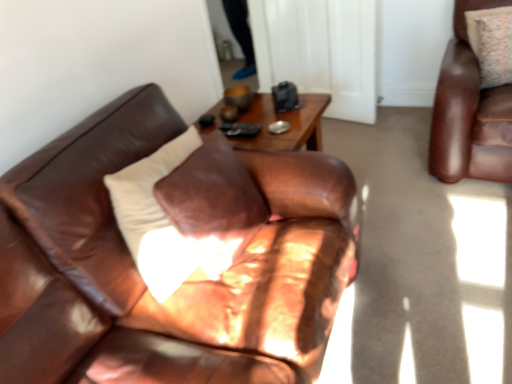
The width and height of the screenshot is (512, 384). Describe the element at coordinates (186, 282) in the screenshot. I see `matte brown leather couch at center` at that location.

Image resolution: width=512 pixels, height=384 pixels. I want to click on transparent glass door at upper center, so point(319,51).

Image resolution: width=512 pixels, height=384 pixels. Describe the element at coordinates (478, 24) in the screenshot. I see `patterned fabric pillow at upper right` at that location.

Where is `matte brown leather couch at center`? This screenshot has width=512, height=384. matte brown leather couch at center is located at coordinates (186, 282).

Does transparent glass door at upper center turn towards matte brown leather couch at center?

No.

Does transparent glass door at upper center have a larger size compared to matte brown leather couch at center?

Incorrect, transparent glass door at upper center is not larger than matte brown leather couch at center.

In the image, is transparent glass door at upper center on the left side or the right side of matte brown leather couch at center?

transparent glass door at upper center is to the left of matte brown leather couch at center.

From the image's perspective, is transparent glass door at upper center located beneath matte brown leather couch at center?

No.

Which of these two, patterned fabric pillow at upper right or transparent glass door at upper center, is smaller?

patterned fabric pillow at upper right is smaller.

Can you tell me how much patterned fabric pillow at upper right and transparent glass door at upper center differ in facing direction?

23.5 degrees separate the facing orientations of patterned fabric pillow at upper right and transparent glass door at upper center.

How distant is patterned fabric pillow at upper right from transparent glass door at upper center?

patterned fabric pillow at upper right and transparent glass door at upper center are 35.30 inches apart from each other.

From the image's perspective, is patterned fabric pillow at upper right above or below transparent glass door at upper center?

Based on their image positions, patterned fabric pillow at upper right is located beneath transparent glass door at upper center.

Does matte brown leather couch at center appear on the left side of transparent glass door at upper center?

In fact, matte brown leather couch at center is to the right of transparent glass door at upper center.

Could you tell me if matte brown leather couch at center is turned towards transparent glass door at upper center?

No.

Find the location of a particular element. studio couch that is in front of the transparent glass door at upper center is located at coordinates [x=186, y=282].

Is transparent glass door at upper center outside of patterned fabric pillow at upper right?

Yes, transparent glass door at upper center is outside of patterned fabric pillow at upper right.

Is the position of transparent glass door at upper center more distant than that of patterned fabric pillow at upper right?

That is True.

Can you confirm if transparent glass door at upper center is thinner than patterned fabric pillow at upper right?

Yes.

Would you say transparent glass door at upper center is a long distance from patterned fabric pillow at upper right?

No, transparent glass door at upper center is not far from patterned fabric pillow at upper right.

How much distance is there between matte brown leather couch at center and patterned fabric pillow at upper right?

They are 1.85 meters apart.

Considering the positions of objects matte brown leather couch at center and patterned fabric pillow at upper right in the image provided, who is more to the left, matte brown leather couch at center or patterned fabric pillow at upper right?

Positioned to the left is matte brown leather couch at center.

Identify the location of pillow above the matte brown leather couch at center (from a real-world perspective). The height and width of the screenshot is (384, 512). (478, 24).

Would you say matte brown leather couch at center is a long distance from patterned fabric pillow at upper right?

matte brown leather couch at center is far away from patterned fabric pillow at upper right.

From a real-world perspective, is patterned fabric pillow at upper right positioned under matte brown leather couch at center based on gravity?

Actually, patterned fabric pillow at upper right is physically above matte brown leather couch at center in the real world.

Is patterned fabric pillow at upper right spatially inside matte brown leather couch at center, or outside of it?

patterned fabric pillow at upper right is not inside matte brown leather couch at center, it's outside.

Considering the relative sizes of patterned fabric pillow at upper right and matte brown leather couch at center in the image provided, is patterned fabric pillow at upper right wider than matte brown leather couch at center?

Incorrect, the width of patterned fabric pillow at upper right does not surpass that of matte brown leather couch at center.

Is patterned fabric pillow at upper right positioned with its back to matte brown leather couch at center?

No, patterned fabric pillow at upper right is not facing away from matte brown leather couch at center.

The image size is (512, 384). What are the coordinates of `studio couch that appears in front of the transparent glass door at upper center` in the screenshot? It's located at (186, 282).

Locate an element on the screen. This screenshot has height=384, width=512. pillow on the right of transparent glass door at upper center is located at coordinates (478, 24).

From the image, which object appears to be nearer to patterned fabric pillow at upper right, matte brown leather couch at center or transparent glass door at upper center?

Among the two, transparent glass door at upper center is located nearer to patterned fabric pillow at upper right.

Which object lies further to the anchor point transparent glass door at upper center, patterned fabric pillow at upper right or matte brown leather couch at center?

Among the two, matte brown leather couch at center is located further to transparent glass door at upper center.

Looking at the image, which one is located closer to transparent glass door at upper center, matte brown leather couch at center or patterned fabric pillow at upper right?

patterned fabric pillow at upper right.

When comparing their distances from patterned fabric pillow at upper right, does transparent glass door at upper center or matte brown leather couch at center seem further?

Among the two, matte brown leather couch at center is located further to patterned fabric pillow at upper right.

Considering their positions, is transparent glass door at upper center positioned further to matte brown leather couch at center than patterned fabric pillow at upper right?

Among the two, patterned fabric pillow at upper right is located further to matte brown leather couch at center.

In the scene shown: When comparing their distances from matte brown leather couch at center, does patterned fabric pillow at upper right or transparent glass door at upper center seem further?

patterned fabric pillow at upper right lies further to matte brown leather couch at center than the other object.

Where is `pillow between matte brown leather couch at center and transparent glass door at upper center in the front-back direction`? This screenshot has height=384, width=512. pillow between matte brown leather couch at center and transparent glass door at upper center in the front-back direction is located at coordinates (478, 24).